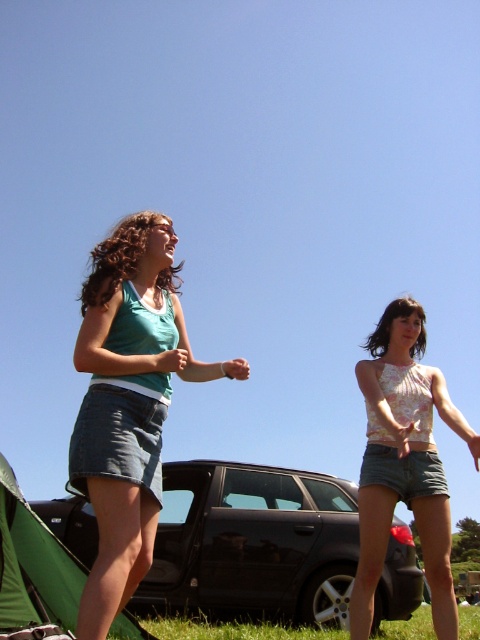
You are planning to take a photo of the denim skirt at left and the floral halter top at center. The camera you have can only focus on objects within a 5 feet range. Will both items be in focus?

The denim skirt at left and floral halter top at center are 4.96 feet apart, so yes, both items will be in focus since the distance between them is within the camera focus range of 5 feet.

You are standing at the origin point of the image coordinate system, which has its origin at the bottom left corner. The black metallic car at center is located at point (252, 545). If you want to walk directly to the black metallic car at center, in which direction should you move first?

Since the coordinate system has its origin at the bottom left corner, the point (252, 545) indicates that the black metallic car at center is to the right and slightly above your current position. Therefore, you should move first to the right and then upwards to reach it.